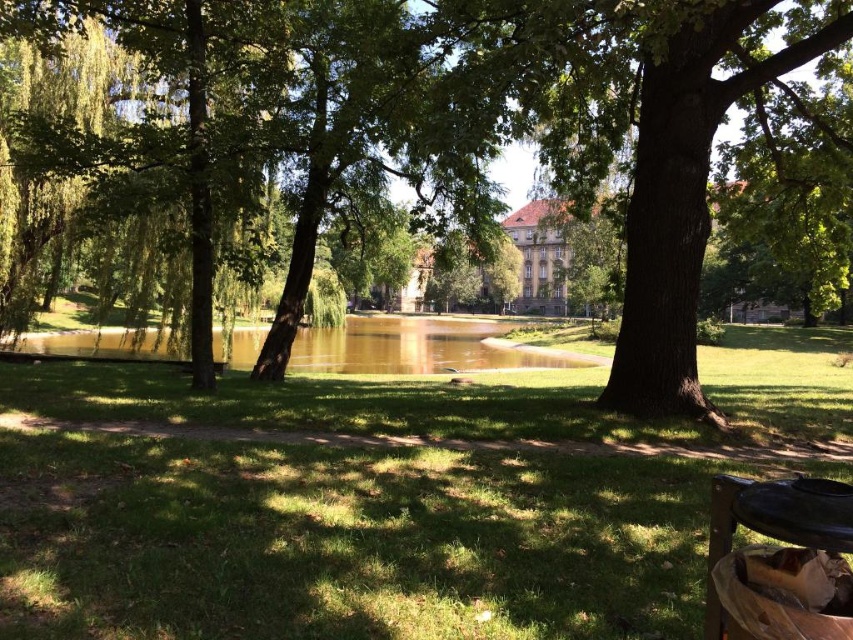
Looking at this image, you are standing at the center of the park and want to take a photo of the green leafy tree at center. According to the coordinates provided, in which direction should you move to position yourself directly in front of the tree?

The green leafy tree at center is located at coordinates point (556, 132). Since the tree is at the center of the park, you are already positioned directly in front of it.

From the picture: You are standing at the edge of the pond in the park scene. You want to find the green grass at center. According to the scene description, where exactly is the green grass located in terms of coordinates?

The green grass at center is located at coordinates point [346,513].